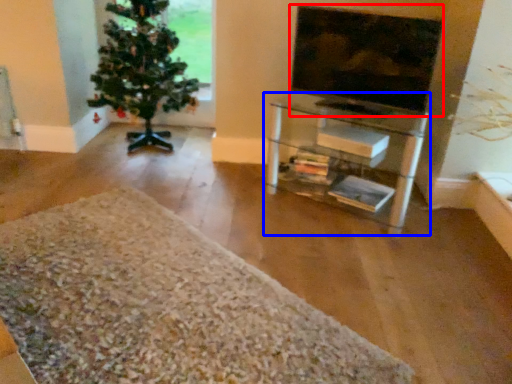
Question: Which point is closer to the camera, television (highlighted by a red box) or shelf (highlighted by a blue box)?

Choices:
 (A) television
 (B) shelf

Answer: (A)